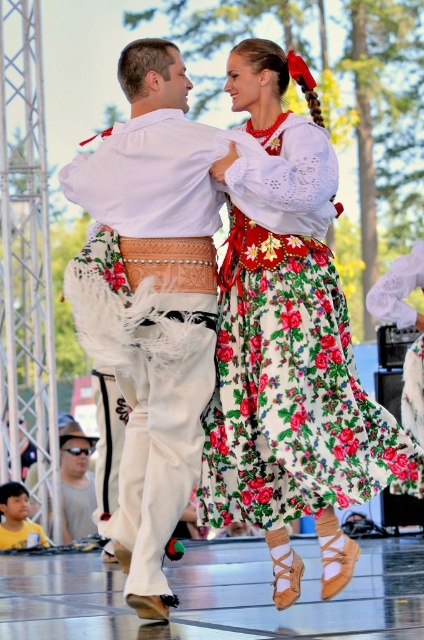
In the dance performance scene, there are two dancers wearing a floral cotton skirt at center and white leather pants at center. Which of these two items is located to the right of the other?

The floral cotton skirt at center is positioned on the right side of white leather pants at center.

You are a photographer at the dance performance. You want to capture a closeup of the floral cotton skirt at center and the white leather pants at center in the same frame. Which one of the two items will appear larger in the photo?

The floral cotton skirt at center will appear larger in the photo because it is larger in size than the white leather pants at center.